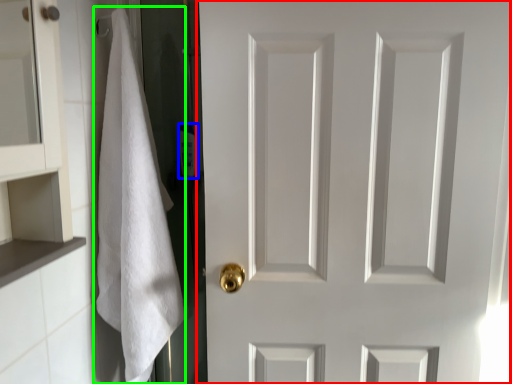
Question: Which is nearer to the door (highlighted by a red box)? toiletry (highlighted by a blue box) or bath towel (highlighted by a green box).

Choices:
 (A) toiletry
 (B) bath towel

Answer: (B)